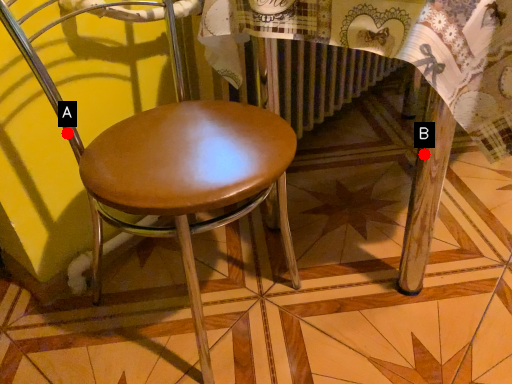
Question: Two points are circled on the image, labeled by A and B beside each circle. Which of the following is the closest to the observer?

Choices:
 (A) A is closer
 (B) B is closer

Answer: (A)